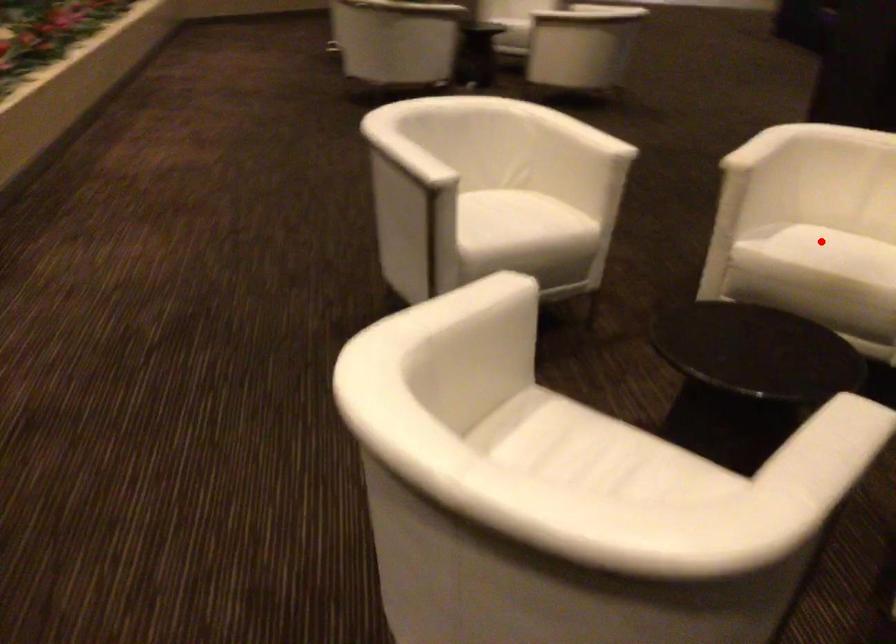
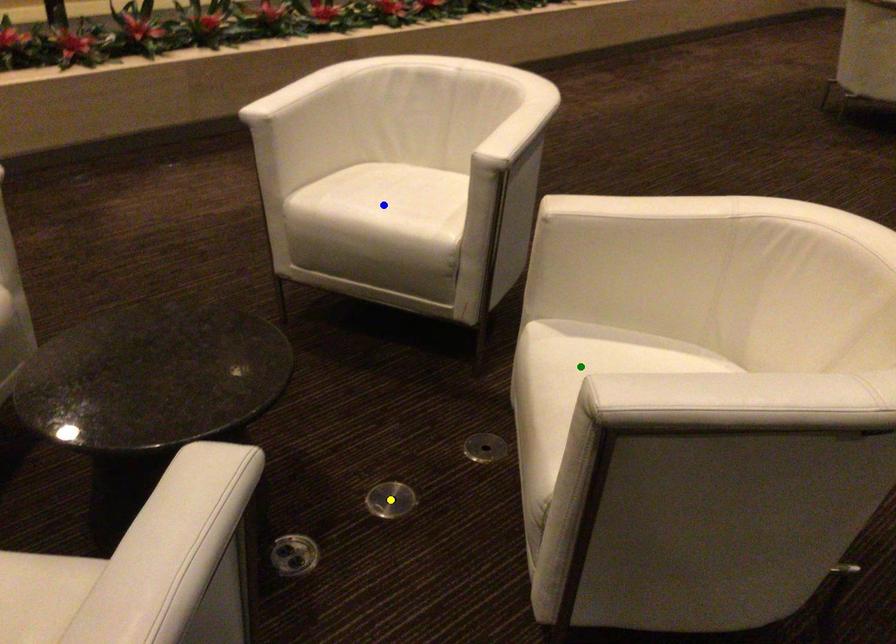
Question: I am providing you with two images of the same scene from different viewpoints. A red point is marked on the first image. You are given multiple points on the second image. Can you choose the point in image 2 that corresponds to the point in image 1?

Choices:
 (A) yellow point
 (B) green point
 (C) blue point

Answer: (B)